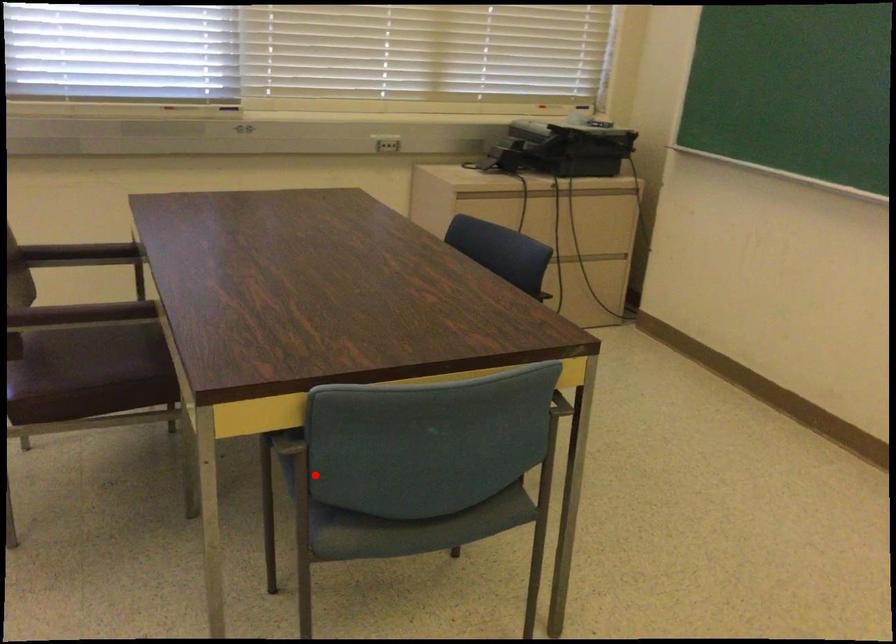
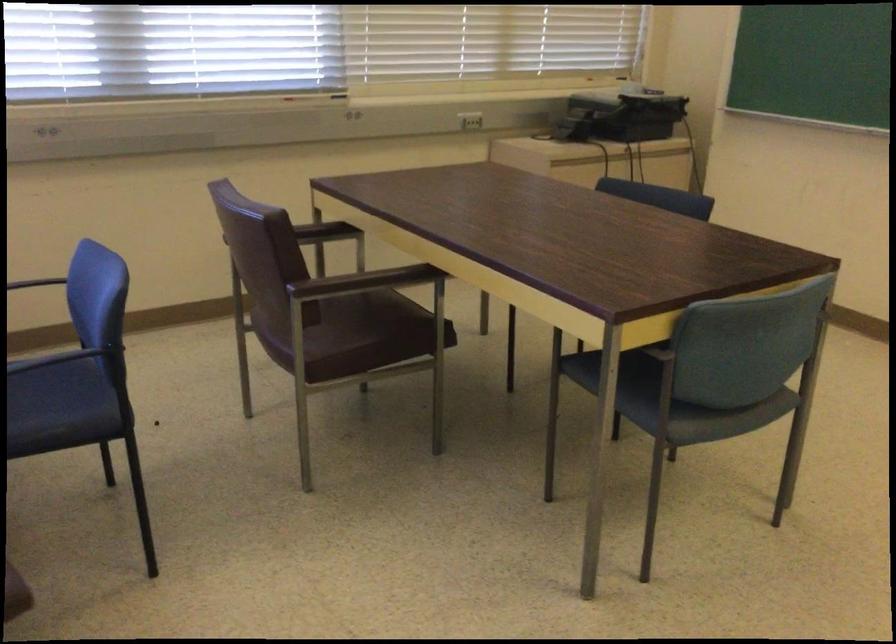
Question: I am providing you with two images of the same scene from different viewpoints. In image1, a red point is highlighted. Considering the same 3D point in image2, which of the following is correct?

Choices:
 (A) It is closer
 (B) It is farther

Answer: (B)